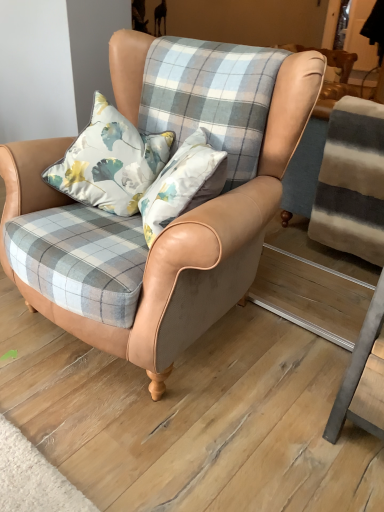
Question: In the image, is leather armchair at center on the left side or the right side of floral satin pillow at center?

Choices:
 (A) right
 (B) left

Answer: (A)

Question: Which is correct: leather armchair at center is inside floral satin pillow at center, or outside of it?

Choices:
 (A) outside
 (B) inside

Answer: (A)

Question: From the image's perspective, relative to floral satin pillow at center, is leather armchair at center above or below?

Choices:
 (A) below
 (B) above

Answer: (A)

Question: From a real-world perspective, is floral satin pillow at center positioned above or below leather armchair at center?

Choices:
 (A) below
 (B) above

Answer: (B)

Question: Relative to leather armchair at center, is floral satin pillow at center in front or behind?

Choices:
 (A) front
 (B) behind

Answer: (B)

Question: From the image's perspective, relative to leather armchair at center, is floral satin pillow at center above or below?

Choices:
 (A) below
 (B) above

Answer: (B)

Question: Is point (44, 177) positioned closer to the camera than point (248, 231)?

Choices:
 (A) closer
 (B) farther

Answer: (B)